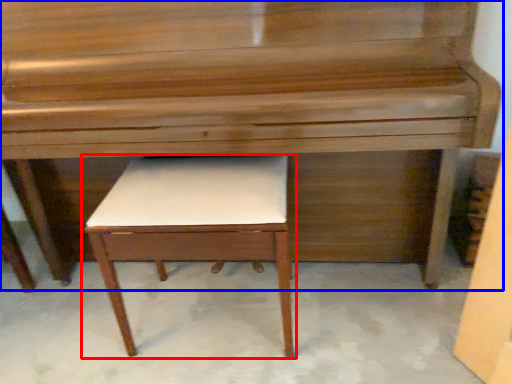
Question: Which object is closer to the camera taking this photo, table (highlighted by a red box) or piano (highlighted by a blue box)?

Choices:
 (A) table
 (B) piano

Answer: (B)